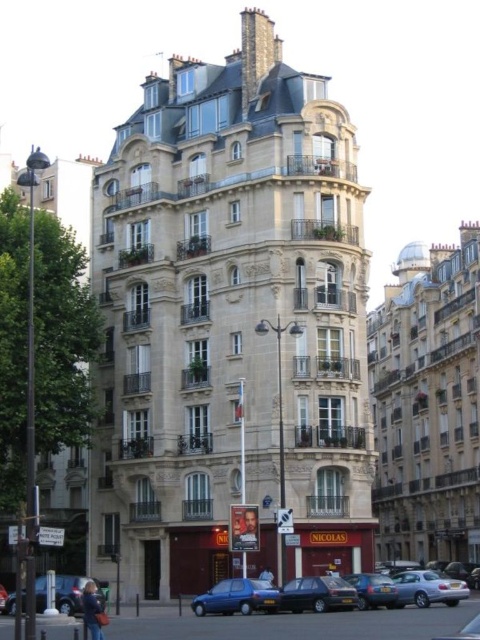
You are a photographer standing in front of the residential building. You want to take a photo of the shiny black sedan at center and the smooth brown hair at center. Which object should you focus on first if you want to capture both in one frame without moving the camera?

The shiny black sedan at center has a lesser height compared to smooth brown hair at center, so you should focus on the shiny black sedan at center first as it is closer to the camera.

You are a photographer standing in front of the building and notice a person wearing a light blue denim jacket at lower left and another person with smooth brown hair at center. Which object is positioned lower in the image?

The light blue denim jacket at lower left is located below the smooth brown hair at center, so the light blue denim jacket at lower left is positioned lower in the image.

You are a delivery person trying to park your shiny black sedan at center near the entrance of the building. However, there is a person with smooth brown hair at center in the way. Can you park your vehicle there without moving the person?

The shiny black sedan at center is bigger than smooth brown hair at center, so yes, you can park the vehicle there since the sedan can easily accommodate around the smaller smooth brown hair at center.